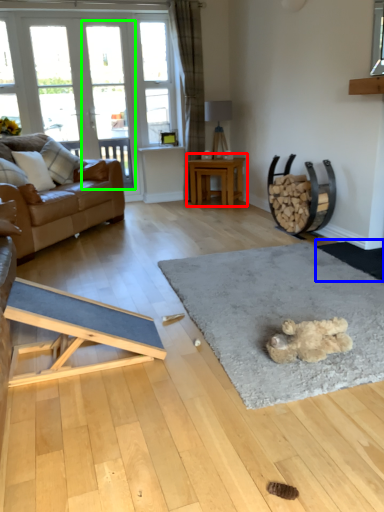
Question: Which is nearer to the table (highlighted by a red box)? doormat (highlighted by a blue box) or screen door (highlighted by a green box).

Choices:
 (A) doormat
 (B) screen door

Answer: (B)